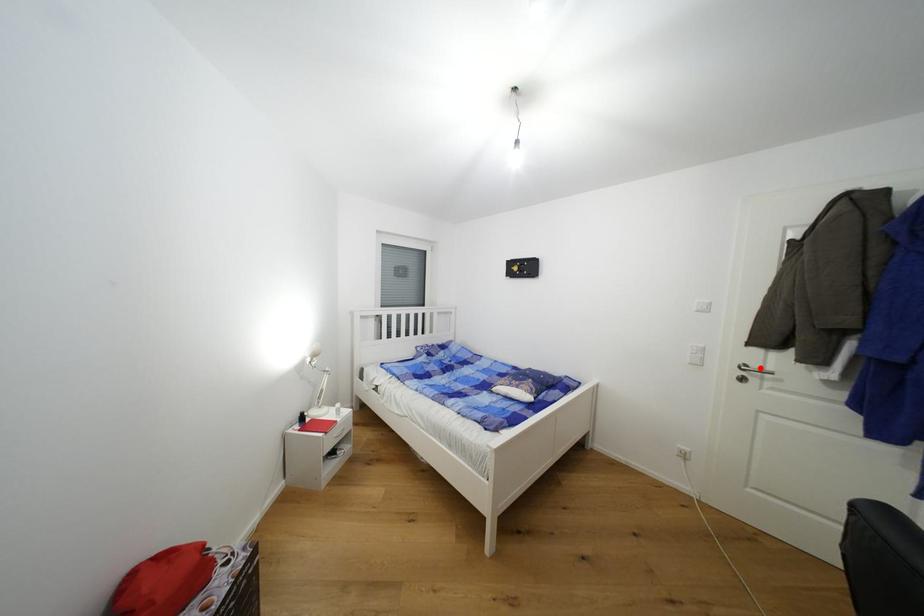
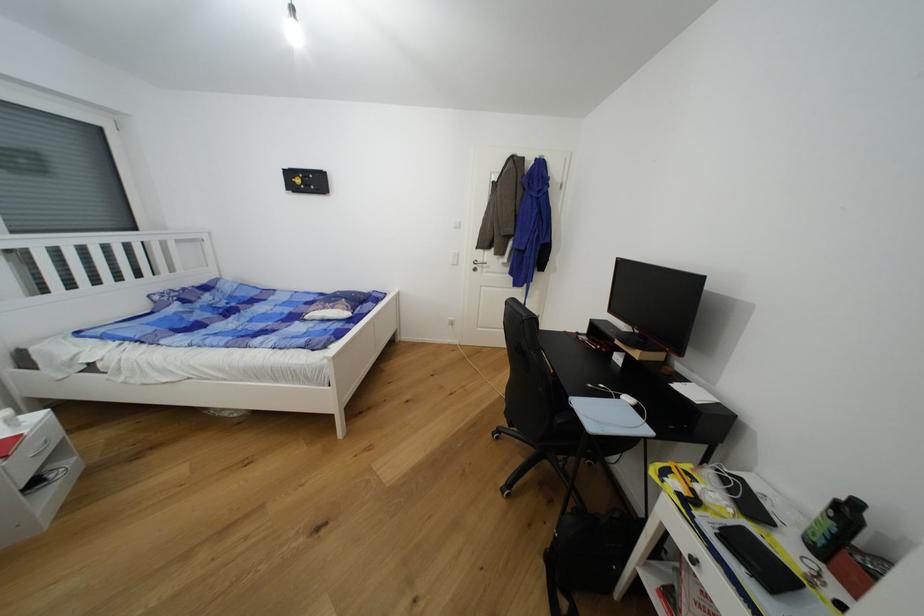
In the second image, find the point that corresponds to the highlighted location in the first image.

(484, 262)